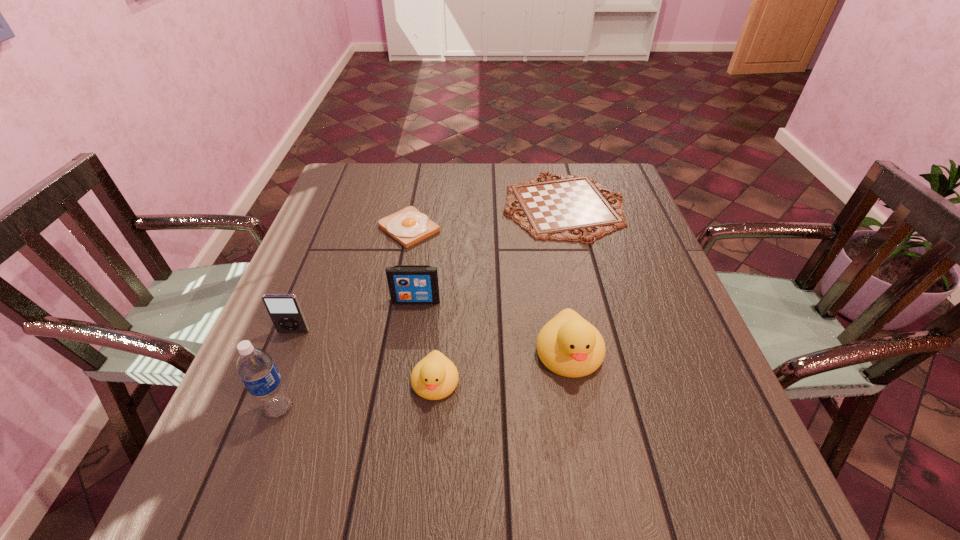
Locate an element on the screen. The image size is (960, 540). water bottle at the left edge is located at coordinates (256, 368).

The width and height of the screenshot is (960, 540). Identify the location of object that is at the right edge. (568, 208).

Find the location of a particular element. The height and width of the screenshot is (540, 960). object situated at the near left corner is located at coordinates (256, 368).

Where is `object that is at the far right corner`? Image resolution: width=960 pixels, height=540 pixels. object that is at the far right corner is located at coordinates (568, 208).

Find the location of `vacant space at the far edge of the desktop`. vacant space at the far edge of the desktop is located at coordinates (493, 168).

Find the location of a particular element. free region at the near edge of the desktop is located at coordinates (539, 419).

In the image, there is a desktop. Find the location of `free space at the left edge`. free space at the left edge is located at coordinates pyautogui.click(x=329, y=204).

This screenshot has height=540, width=960. I want to click on vacant region at the right edge of the desktop, so click(635, 254).

Where is `vacant space at the far left corner`? The height and width of the screenshot is (540, 960). vacant space at the far left corner is located at coordinates (335, 193).

In the image, there is a desktop. Identify the location of vacant space at the near left corner. (248, 429).